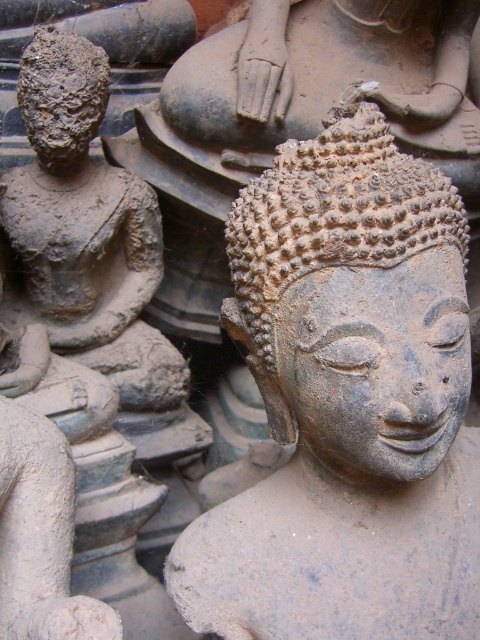
Question: Considering the relative positions of matte stone head at center and matte clay head at left in the image provided, where is matte stone head at center located with respect to matte clay head at left?

Choices:
 (A) right
 (B) left

Answer: (A)

Question: Which object appears closest to the camera in this image?

Choices:
 (A) matte stone head at center
 (B) matte clay head at left

Answer: (A)

Question: Can you confirm if matte stone head at center is bigger than matte clay head at left?

Choices:
 (A) no
 (B) yes

Answer: (B)

Question: Which of the following is the farthest from the observer?

Choices:
 (A) (363, 164)
 (B) (86, 136)

Answer: (B)

Question: Is matte stone head at center thinner than matte clay head at left?

Choices:
 (A) yes
 (B) no

Answer: (B)